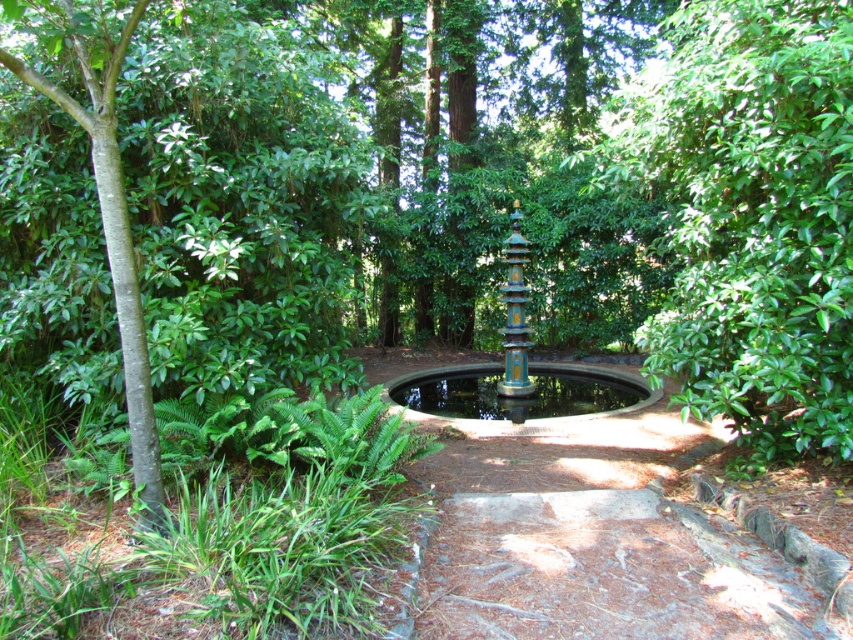
Who is more forward, (718, 72) or (608, 394)?

Point (718, 72)

Is green leafy tree at center to the left of blue painted metal fountain at center from the viewer's perspective?

Incorrect, green leafy tree at center is not on the left side of blue painted metal fountain at center.

Which is in front, point (807, 42) or point (471, 371)?

Positioned in front is point (807, 42).

You are a GUI agent. You are given a task and a screenshot of the screen. Output one action in this format:
    pyautogui.click(x=<x>, y=<y>)
    Task: Click on the green leafy tree at center
    This screenshot has height=640, width=853.
    Given the screenshot: What is the action you would take?
    (751, 216)

Does green leafy tree at center have a greater width compared to green smooth bark tree at left?

Indeed, green leafy tree at center has a greater width compared to green smooth bark tree at left.

Between green leafy tree at center and green smooth bark tree at left, which one appears on the right side from the viewer's perspective?

From the viewer's perspective, green leafy tree at center appears more on the right side.

Is point (608, 179) more distant than point (125, 282)?

Yes, point (608, 179) is behind point (125, 282).

At what (x,y) coordinates should I click in order to perform the action: click on green leafy tree at center. Please return your answer as a coordinate pair (x, y). This screenshot has height=640, width=853. Looking at the image, I should click on coord(751,216).

Does green leafy tree at center have a larger size compared to multicolored painted fountain at center?

Actually, green leafy tree at center might be smaller than multicolored painted fountain at center.

Is green leafy tree at center above multicolored painted fountain at center?

Yes.

Image resolution: width=853 pixels, height=640 pixels. What do you see at coordinates (751, 216) in the screenshot?
I see `green leafy tree at center` at bounding box center [751, 216].

Identify the location of green leafy tree at center. (751, 216).